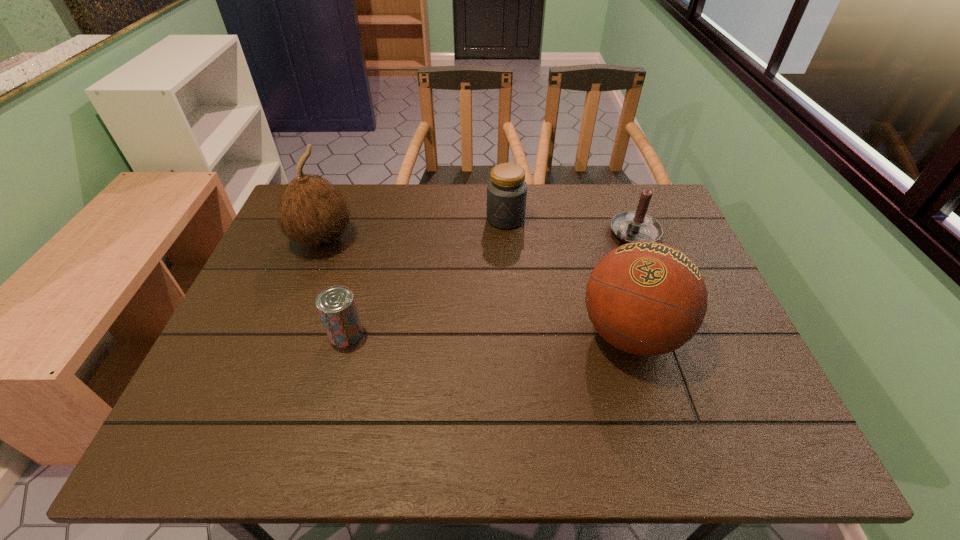
Identify the location of object located in the near edge section of the desktop. The width and height of the screenshot is (960, 540). (646, 298).

This screenshot has height=540, width=960. What are the coordinates of `object positioned at the left edge` in the screenshot? It's located at (311, 210).

Locate an element on the screen. basketball that is at the right edge is located at coordinates (646, 298).

Where is `candle present at the right edge`? This screenshot has height=540, width=960. candle present at the right edge is located at coordinates (634, 226).

The width and height of the screenshot is (960, 540). I want to click on object that is at the far left corner, so click(x=311, y=210).

The image size is (960, 540). I want to click on object at the far right corner, so click(634, 226).

You are a GUI agent. You are given a task and a screenshot of the screen. Output one action in this format:
    pyautogui.click(x=<x>, y=<y>)
    Task: Click on the object that is at the near right corner
    Image resolution: width=960 pixels, height=540 pixels.
    Given the screenshot: What is the action you would take?
    pyautogui.click(x=646, y=298)

Image resolution: width=960 pixels, height=540 pixels. What are the coordinates of `blank space at the far edge of the desktop` in the screenshot? It's located at (447, 227).

Image resolution: width=960 pixels, height=540 pixels. I want to click on free space at the near edge of the desktop, so pos(362,376).

Image resolution: width=960 pixels, height=540 pixels. In order to click on free space at the left edge of the desktop in this screenshot , I will do `click(233, 332)`.